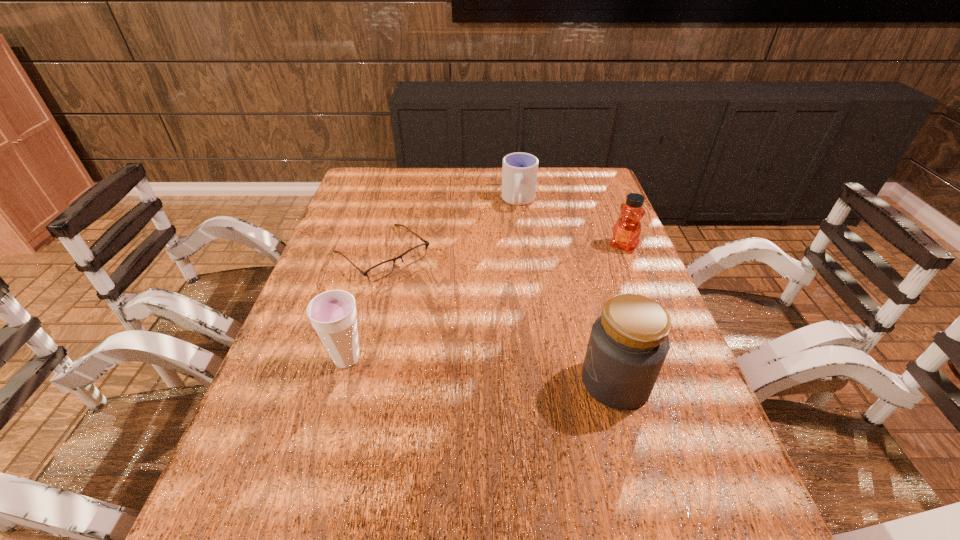
The width and height of the screenshot is (960, 540). Identify the location of the nearer cup. (333, 314).

Where is `the left cup`? the left cup is located at coordinates (333, 314).

In order to click on jar in this screenshot , I will do `click(628, 344)`.

I want to click on the tallest object, so click(628, 344).

Find the location of `the shorter cup`. the shorter cup is located at coordinates (519, 172).

Image resolution: width=960 pixels, height=540 pixels. Identify the location of the third object from left to right. (519, 172).

You are a GUI agent. You are given a task and a screenshot of the screen. Output one action in this format:
    pyautogui.click(x=<x>, y=<y>)
    Task: Click on the spectacles
    
    Given the screenshot: What is the action you would take?
    pyautogui.click(x=381, y=270)

Image resolution: width=960 pixels, height=540 pixels. Find the location of `the rightmost object`. the rightmost object is located at coordinates (626, 232).

At what (x,y) coordinates should I click in order to perform the action: click on vacant space positioned on the front of the taller cup. Please return your answer as a coordinate pair (x, y). Looking at the image, I should click on coord(319,458).

Find the location of a particular element. This screenshot has width=960, height=540. vacant area located on the surface of the jar near the warning symbol is located at coordinates (496, 382).